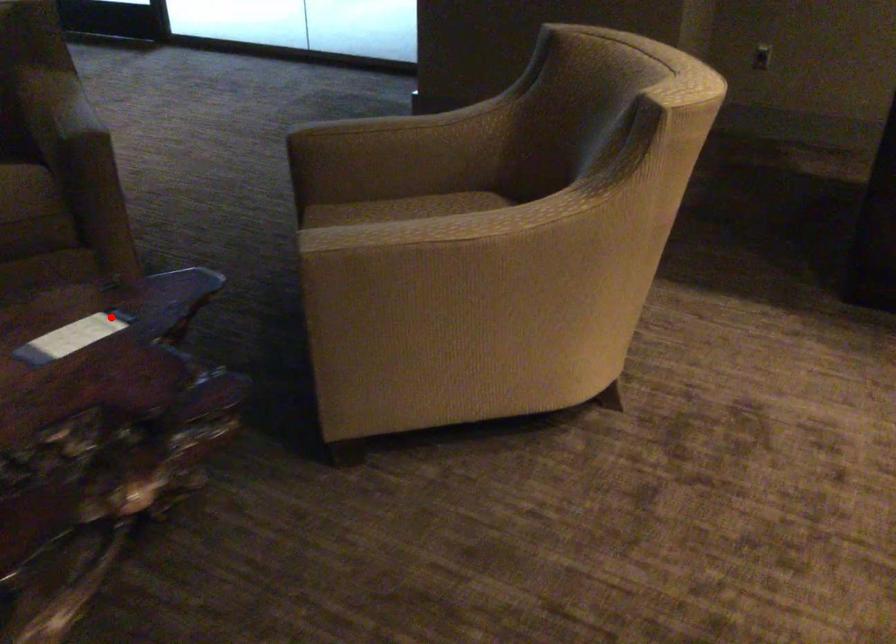
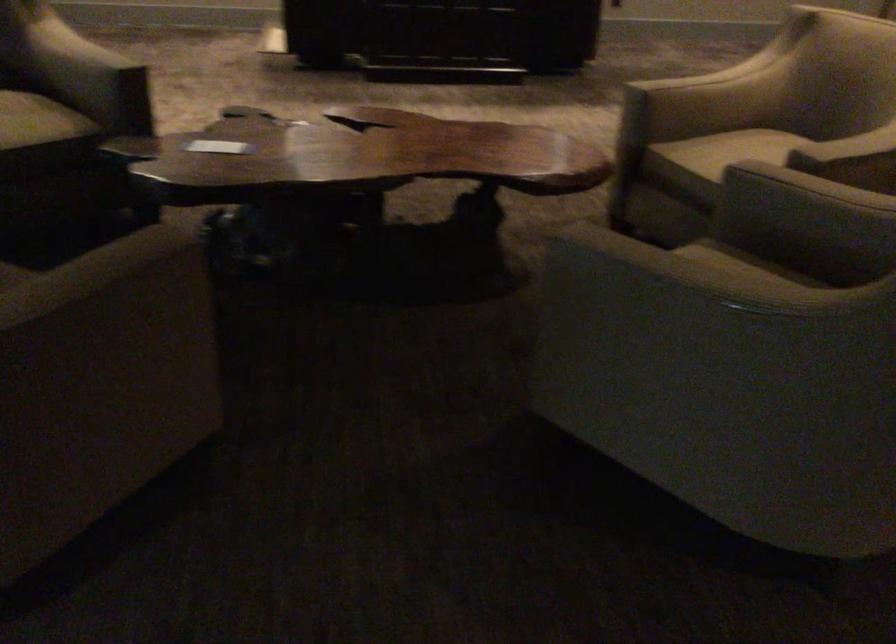
Where in the second image is the point corresponding to the highlighted location from the first image?

(218, 146)